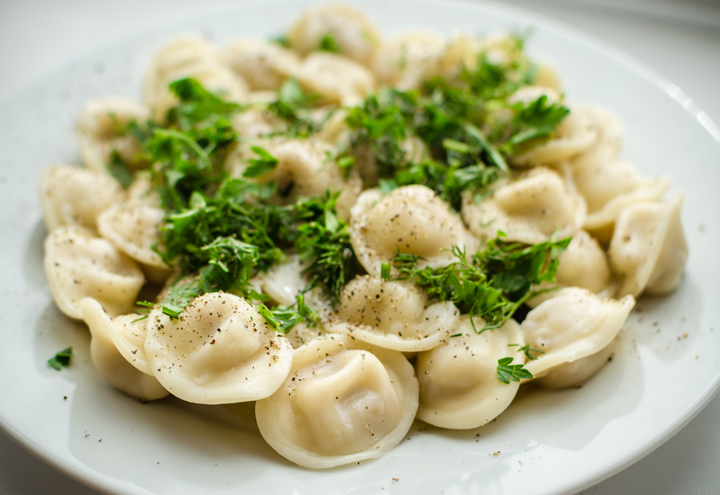
You are a GUI agent. You are given a task and a screenshot of the screen. Output one action in this format:
    pyautogui.click(x=<x>, y=<y>)
    Task: Click on the place to put utensils
    
    Given the screenshot: What is the action you would take?
    pyautogui.click(x=695, y=444)